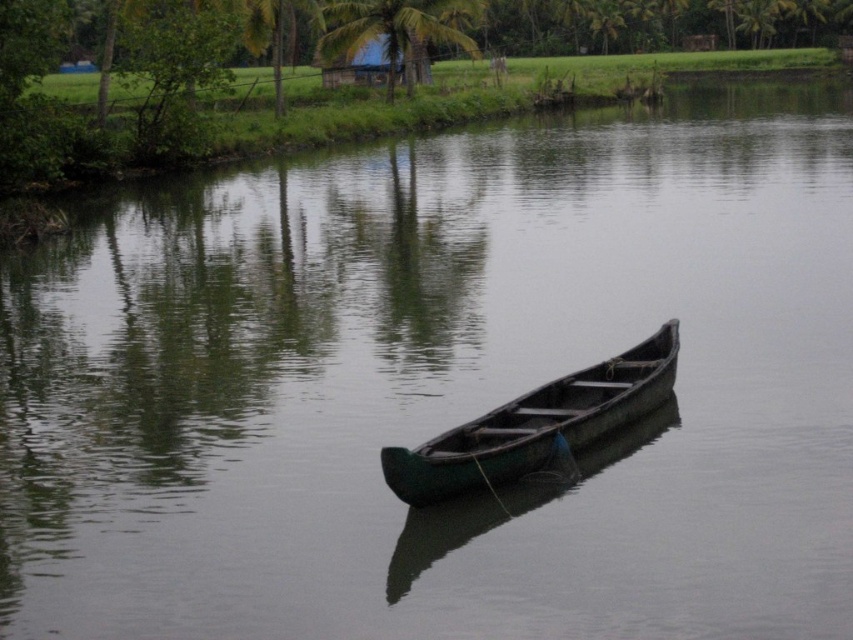
Question: Can you confirm if green wooden canoe at center is positioned above green leafy palm tree at upper center?

Choices:
 (A) no
 (B) yes

Answer: (A)

Question: Is the position of green wooden canoe at center less distant than that of green leafy palm tree at upper center?

Choices:
 (A) yes
 (B) no

Answer: (A)

Question: Is green wooden canoe at center to the right of green leafy palm tree at upper center from the viewer's perspective?

Choices:
 (A) yes
 (B) no

Answer: (A)